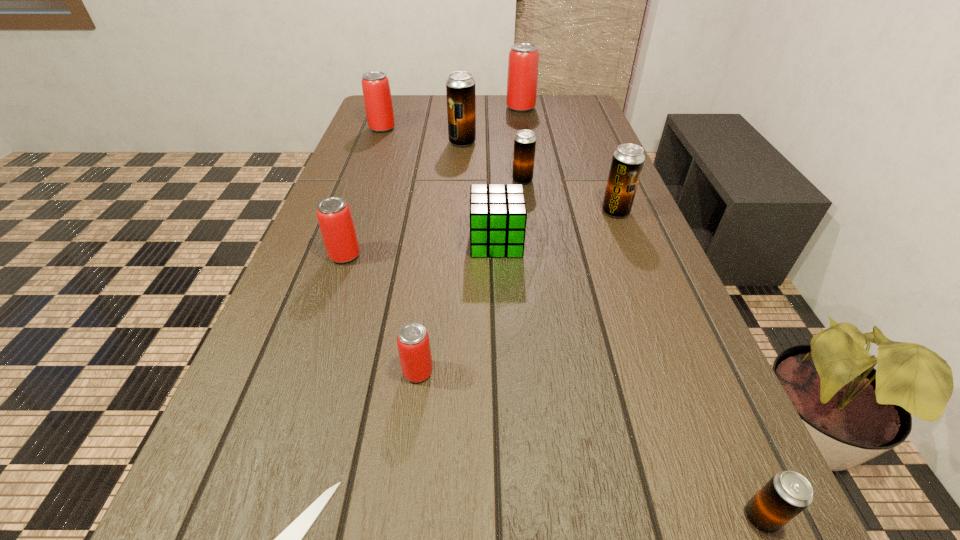
Locate an element on the screen. The image size is (960, 540). the seventh nearest object is located at coordinates (525, 141).

Find the location of `the third nearest black beer can`. the third nearest black beer can is located at coordinates point(525,141).

This screenshot has height=540, width=960. Find the location of `red cube`. red cube is located at coordinates (498, 215).

At what (x,y) coordinates should I click in order to perform the action: click on the nearest pink beer can. Please return your answer as a coordinate pair (x, y). Image resolution: width=960 pixels, height=540 pixels. Looking at the image, I should click on (413, 343).

Find the location of a particular element. Image resolution: width=960 pixels, height=540 pixels. the seventh farthest beer can is located at coordinates (413, 343).

This screenshot has height=540, width=960. Find the location of `the nearest black beer can`. the nearest black beer can is located at coordinates (787, 493).

You are a GUI agent. You are given a task and a screenshot of the screen. Output one action in this format:
    pyautogui.click(x=<x>, y=<y>)
    Task: Click on the smallest black beer can
    This screenshot has height=540, width=960.
    Given the screenshot: What is the action you would take?
    pyautogui.click(x=787, y=493)

At what (x,y) coordinates should I click in order to perform the action: click on vacant space located 0.080m on the front of the farthest pink beer can. Please return your answer as a coordinate pair (x, y). Image resolution: width=960 pixels, height=540 pixels. Looking at the image, I should click on (523, 124).

Locate an element on the screen. The image size is (960, 540). free space located on the back of the biggest black beer can is located at coordinates (465, 108).

Locate an element on the screen. vacant position located on the front of the second farthest beer can is located at coordinates pyautogui.click(x=369, y=166).